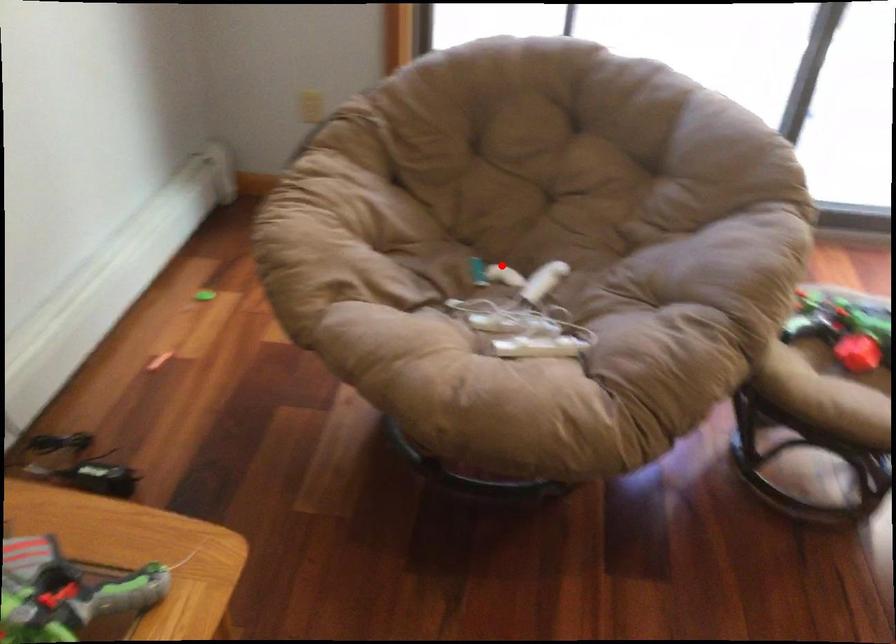
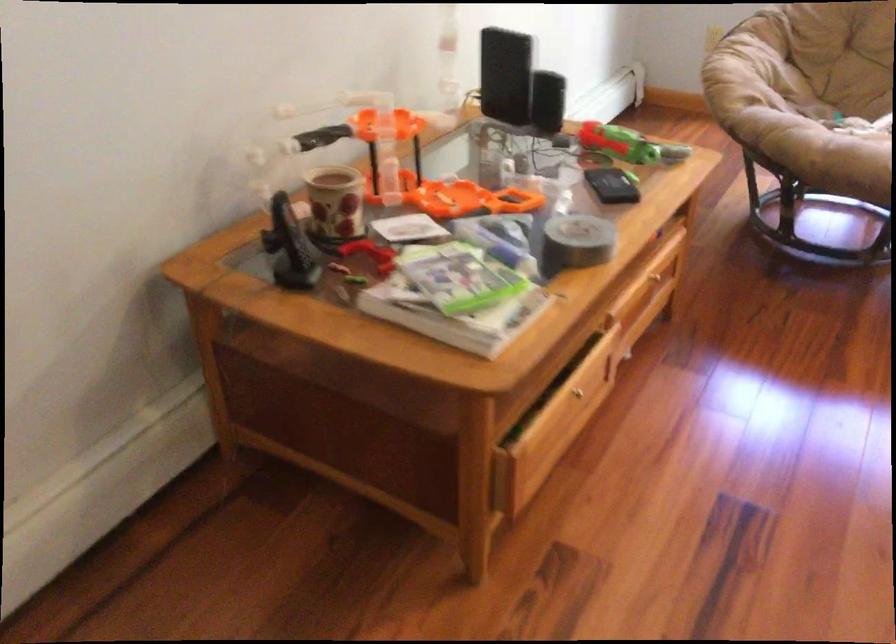
In the second image, find the point that corresponds to the highlighted location in the first image.

(842, 118)